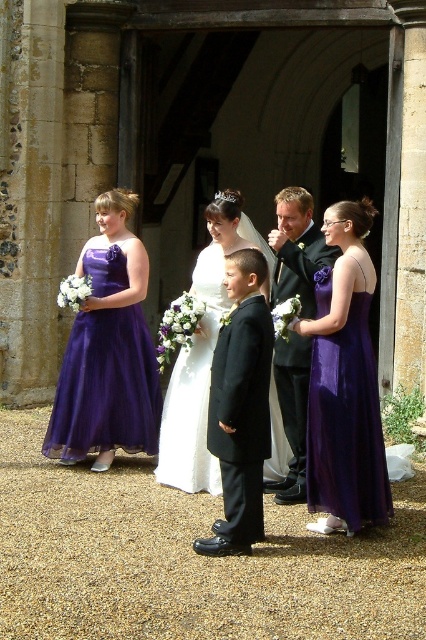
Can you confirm if purple satin dress at left is smaller than purple satin dress at center?

No, purple satin dress at left is not smaller than purple satin dress at center.

The height and width of the screenshot is (640, 426). What are the coordinates of `purple satin dress at left` in the screenshot? It's located at (106, 387).

Between point (118, 246) and point (388, 518), which one is positioned in front?

Positioned in front is point (388, 518).

Find the location of a particular element. This screenshot has height=640, width=426. purple satin dress at left is located at coordinates (106, 387).

Consider the image. Does purple satin dress at left come in front of white satin dress at center?

No, it is not.

Between purple satin dress at left and white satin dress at center, which one is positioned higher?

white satin dress at center

The image size is (426, 640). Describe the element at coordinates (106, 387) in the screenshot. I see `purple satin dress at left` at that location.

Where is `purple satin dress at left`? The height and width of the screenshot is (640, 426). purple satin dress at left is located at coordinates (106, 387).

Which is behind, point (226, 285) or point (241, 458)?

The point (226, 285) is behind.

The width and height of the screenshot is (426, 640). What are the coordinates of `matte purple dress at center` in the screenshot? It's located at (239, 404).